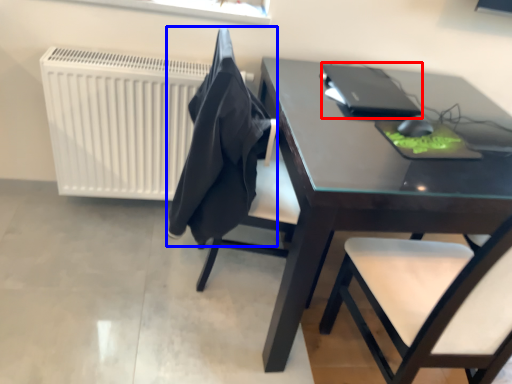
Question: Which object is closer to the camera taking this photo, laptop (highlighted by a red box) or cloth (highlighted by a blue box)?

Choices:
 (A) laptop
 (B) cloth

Answer: (B)